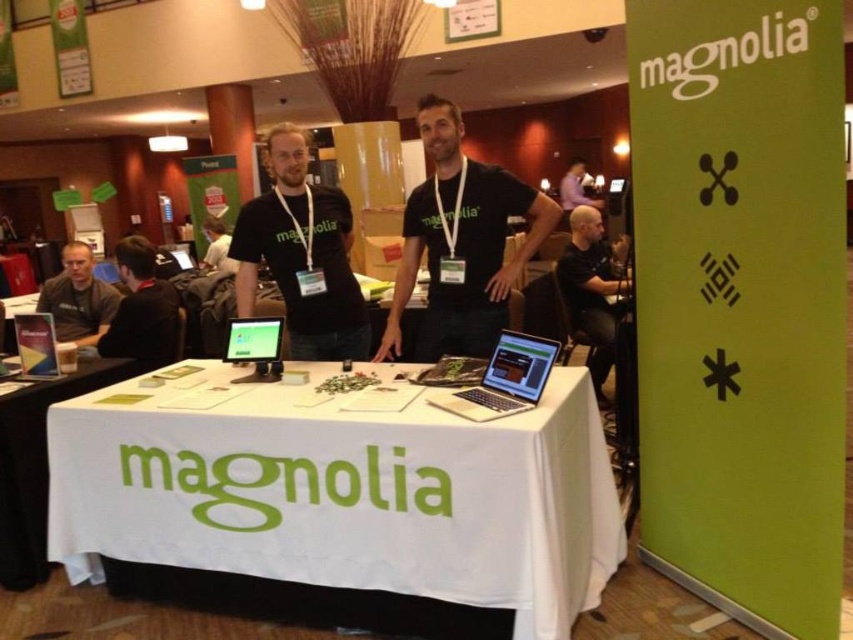
You are at the Magnolia booth and want to locate the white fabric table at center. According to the coordinates provided, where should you look?

You should look at point (341,490) to find the white fabric table at center.

You are a photographer positioned at the camera. You need to capture a photo of the white fabric table at center for a promotional shoot. Considering your current distance, will you need to move closer or farther away to ensure the table fills the frame appropriately?

The white fabric table at center is 6.32 feet away from the camera. To ensure the table fills the frame appropriately, you may need to move slightly closer to frame it properly, as 6.32 feet might be a standard distance but could vary based on lens focal length and desired composition.